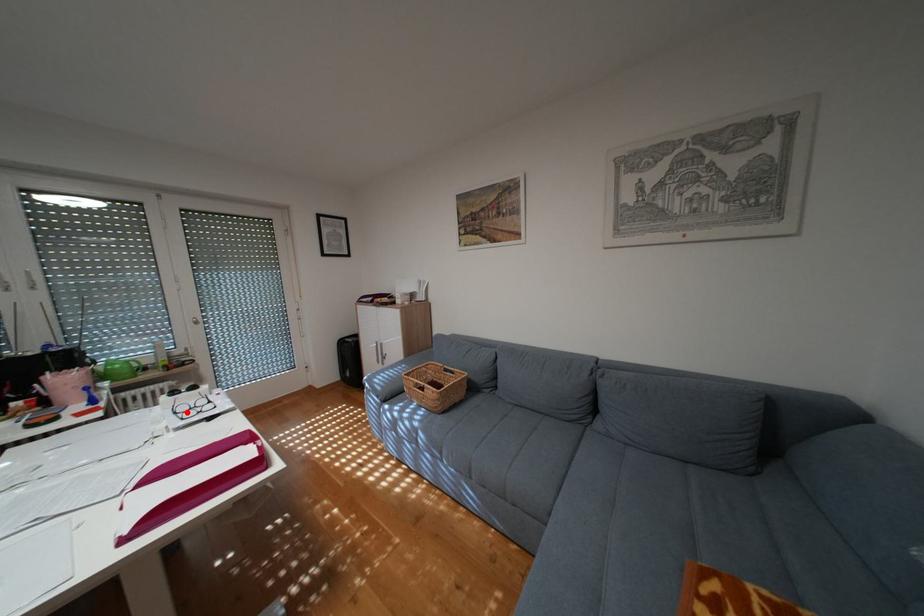
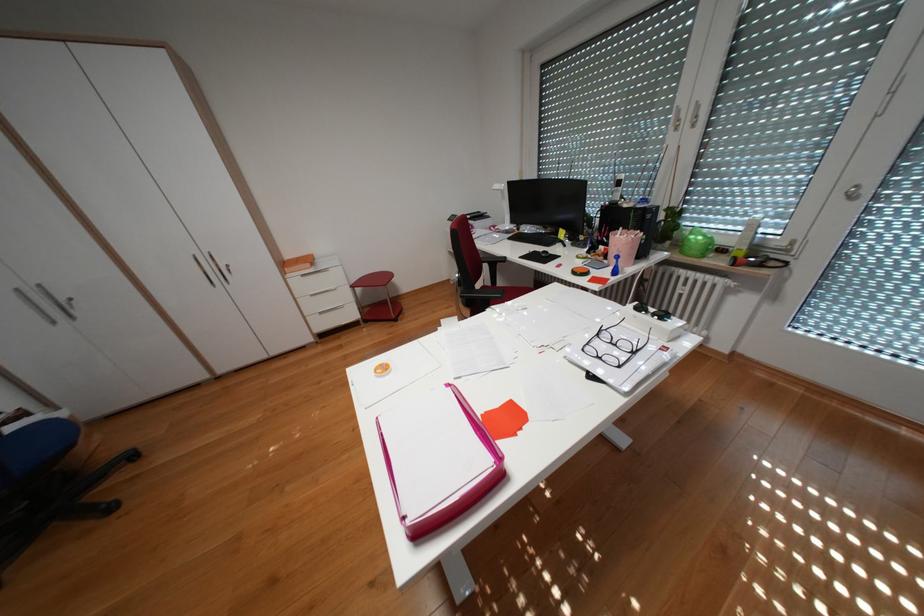
In the second image, find the point that corresponds to the highlighted location in the first image.

(610, 334)